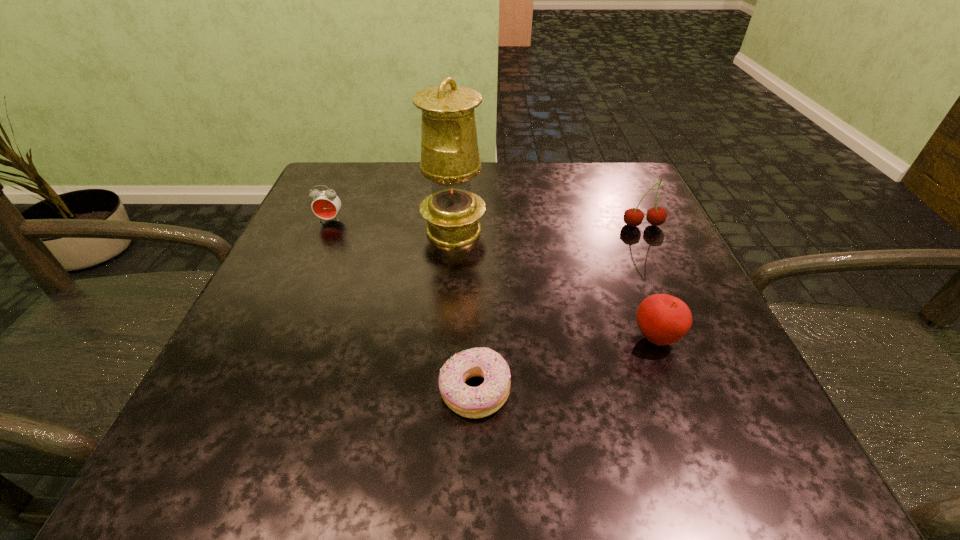
This screenshot has height=540, width=960. Find the location of `vacant space at the left edge of the desktop`. vacant space at the left edge of the desktop is located at coordinates (351, 288).

In the image, there is a desktop. At what (x,y) coordinates should I click in order to perform the action: click on vacant space at the right edge. Please return your answer as a coordinate pair (x, y). Looking at the image, I should click on (633, 293).

This screenshot has width=960, height=540. In order to click on vacant region at the far left corner of the desktop in this screenshot , I will do `click(372, 186)`.

At what (x,y) coordinates should I click in order to perform the action: click on vacant space at the near left corner of the desktop. Please return your answer as a coordinate pair (x, y). The width and height of the screenshot is (960, 540). Looking at the image, I should click on (209, 421).

Find the location of a particular element. This screenshot has height=540, width=960. blank space at the near right corner is located at coordinates (670, 428).

Locate an element on the screen. free point between the tallest object and the leftmost object is located at coordinates (392, 225).

The width and height of the screenshot is (960, 540). I want to click on free spot between the oil lamp and the leftmost object, so [x=392, y=225].

Image resolution: width=960 pixels, height=540 pixels. I want to click on empty space between the tallest object and the fourth shortest object, so click(548, 228).

Find the location of a particular element. Image resolution: width=960 pixels, height=540 pixels. free space between the leftmost object and the tallest object is located at coordinates (392, 225).

I want to click on unoccupied area between the cherry and the alarm clock, so click(x=487, y=222).